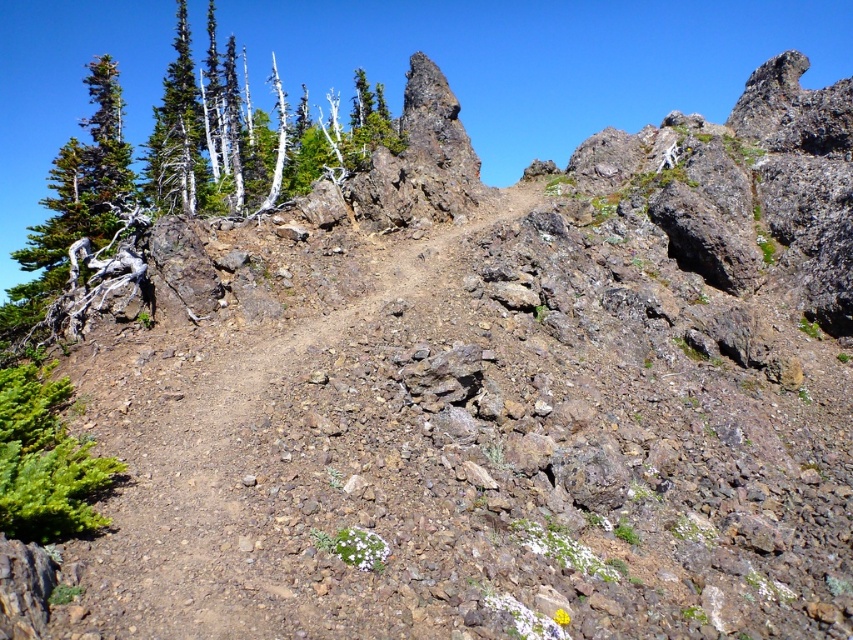
Based on the photo, between green matte tree at upper left and brown dirt track at center, which one is positioned higher?

green matte tree at upper left is higher up.

Which of these two, green matte tree at upper left or brown dirt track at center, stands shorter?

brown dirt track at center is shorter.

Is point (9, 330) positioned in front of point (198, 445)?

That is False.

Identify the location of green matte tree at upper left. (144, 164).